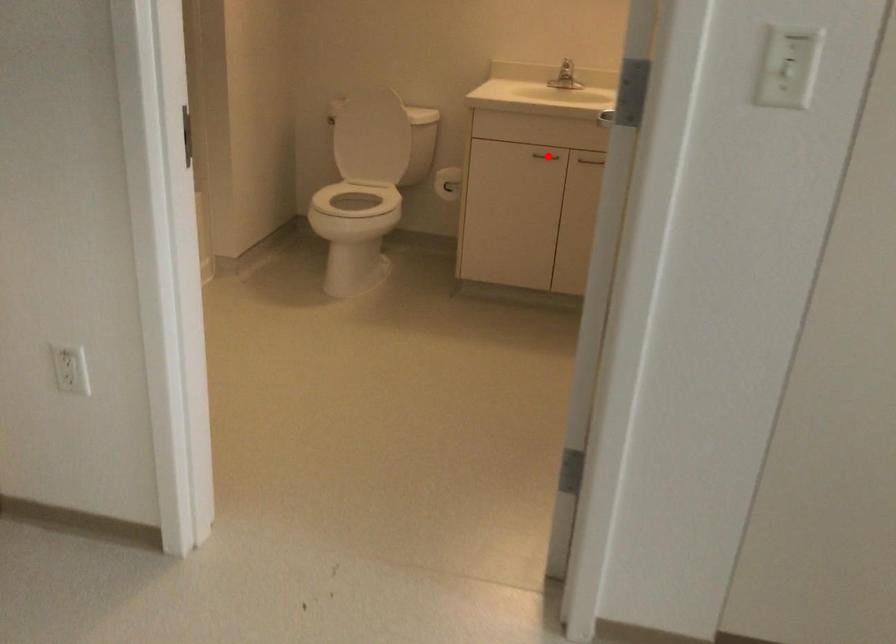
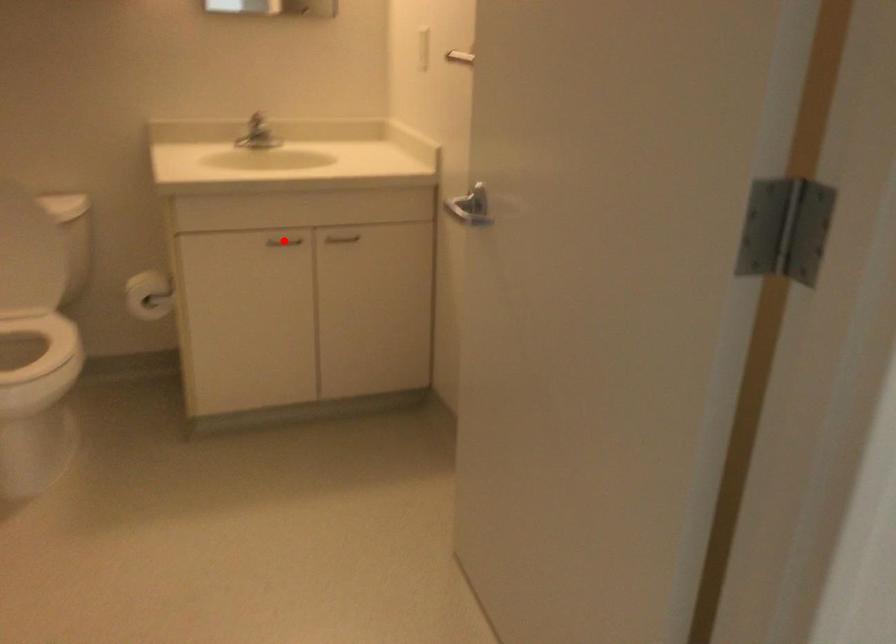
Consider the image. I am providing you with two images of the same scene from different viewpoints. A red point is marked on the first image and another point is marked on the second image. Are the points marked in image1 and image2 representing the same 3D position?

Yes